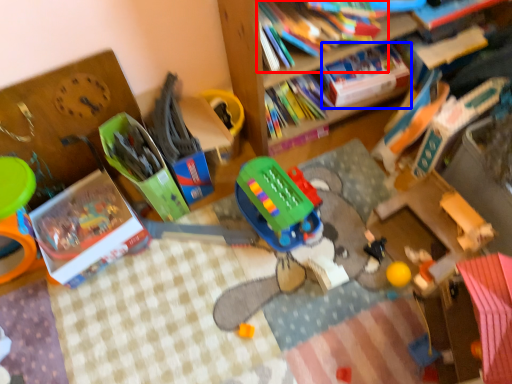
Question: Which object is closer to the camera taking this photo, book (highlighted by a red box) or book (highlighted by a blue box)?

Choices:
 (A) book
 (B) book

Answer: (A)